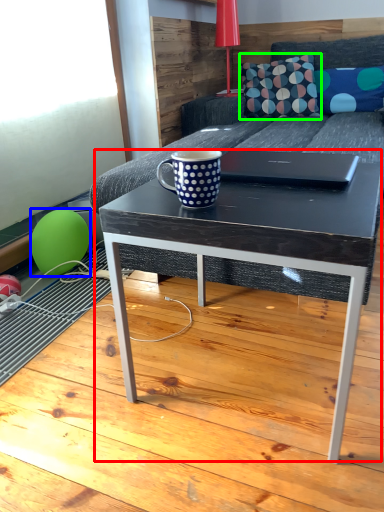
Question: Considering the real-world distances, which object is farthest from coffee table (highlighted by a red box)? balloon (highlighted by a blue box) or throw pillow (highlighted by a green box)?

Choices:
 (A) balloon
 (B) throw pillow

Answer: (B)